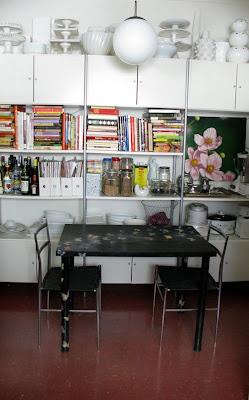
You are a GUI agent. You are given a task and a screenshot of the screen. Output one action in this format:
    pyautogui.click(x=<x>, y=<y>)
    Task: Click on the chair legs
    The image size is (249, 400).
    Given the screenshot: What is the action you would take?
    pyautogui.click(x=40, y=330), pyautogui.click(x=47, y=321), pyautogui.click(x=97, y=334), pyautogui.click(x=102, y=309), pyautogui.click(x=150, y=309), pyautogui.click(x=162, y=325), pyautogui.click(x=216, y=320)